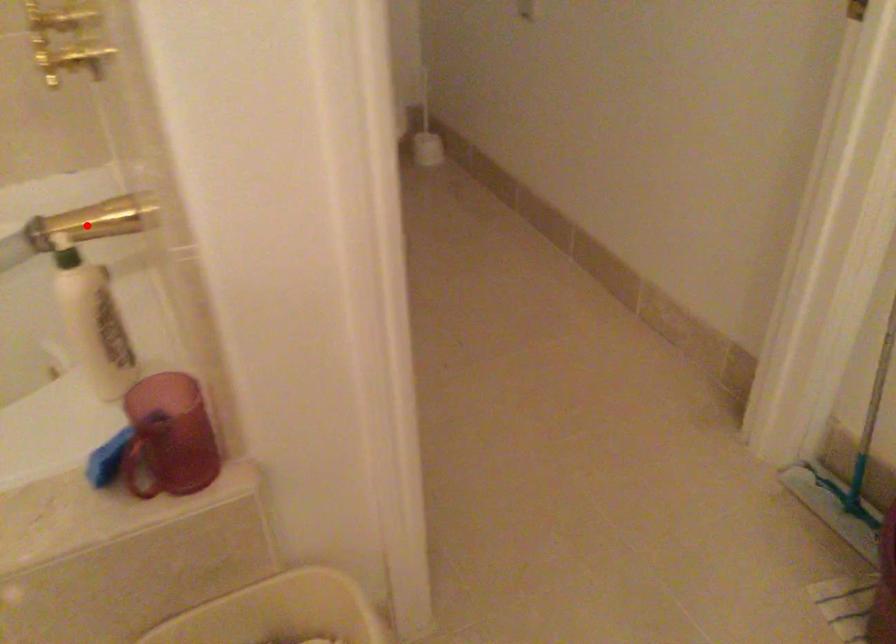
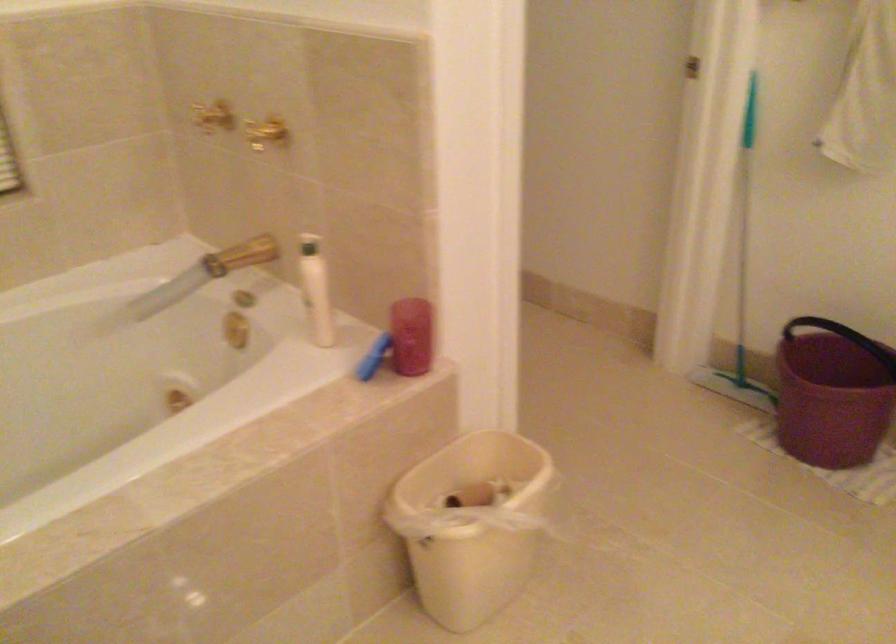
The point at the highlighted location is marked in the first image. Where is the corresponding point in the second image?

(240, 254)